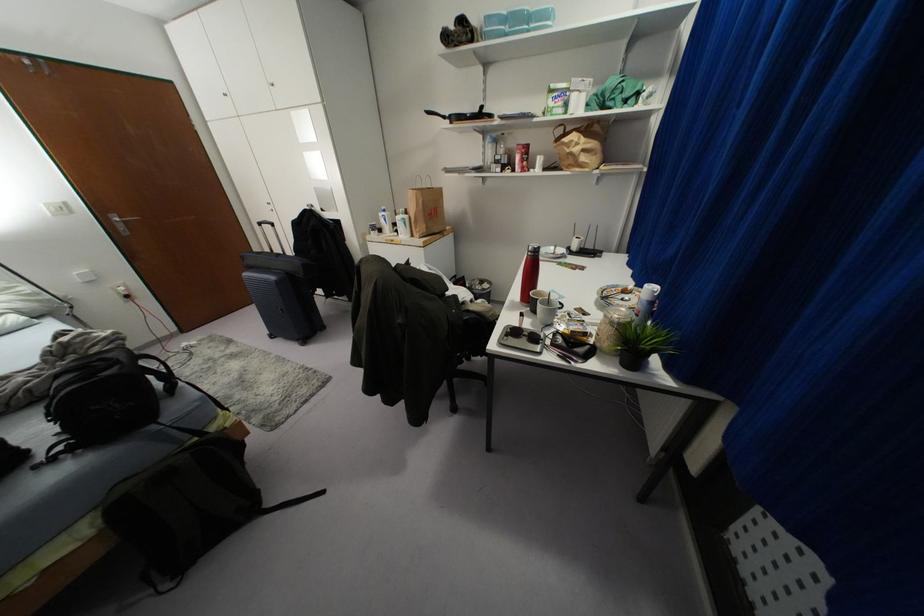
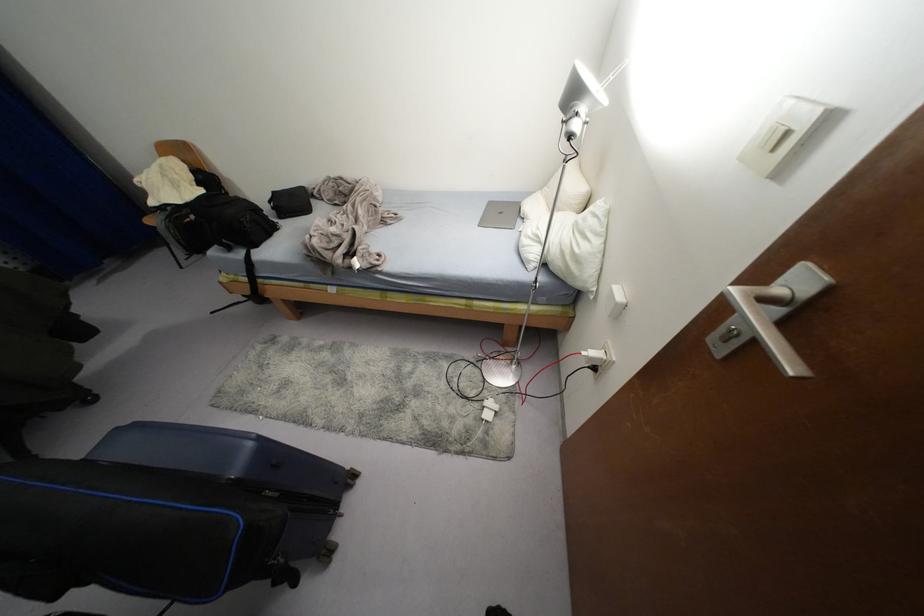
Where in the second image is the point corresponding to (x=192, y=342) from the first image?

(487, 416)